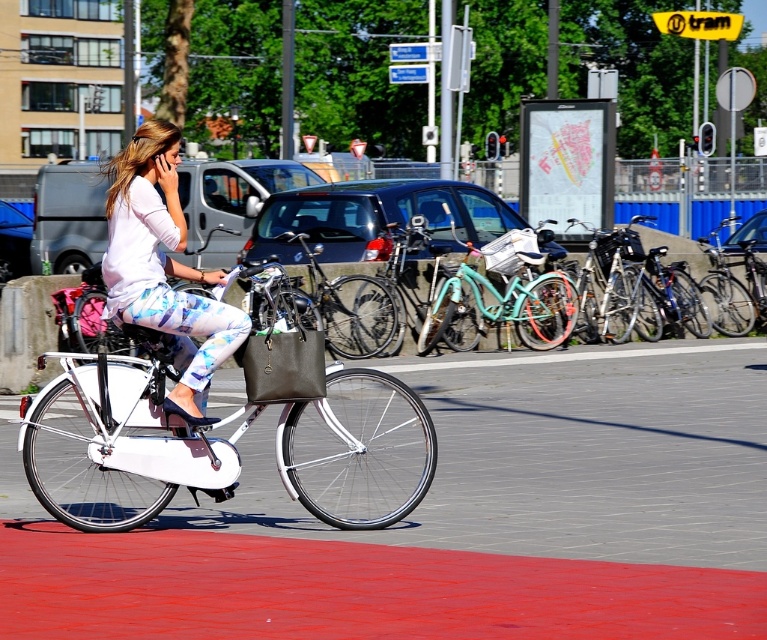
Question: Is white matte bicycle at center bigger than teal matte bicycle at center?

Choices:
 (A) no
 (B) yes

Answer: (A)

Question: Which of the following is the farthest from the observer?

Choices:
 (A) (489, 259)
 (B) (170, 209)

Answer: (A)

Question: Based on their relative distances, which object is farther from the shiny silver bicycle at right?

Choices:
 (A) teal matte bicycle at center
 (B) white matte bicycle at center
 (C) matte white bicycle at center

Answer: (B)

Question: Among these points, which one is farthest from the camera?

Choices:
 (A) (754, 268)
 (B) (515, 250)

Answer: (A)

Question: Can you confirm if shiny silver bicycle at right is positioned to the right of teal matte bicycle basket at center?

Choices:
 (A) yes
 (B) no

Answer: (A)

Question: Does matte white bicycle at center appear on the left side of shiny silver bicycle at right?

Choices:
 (A) no
 (B) yes

Answer: (B)